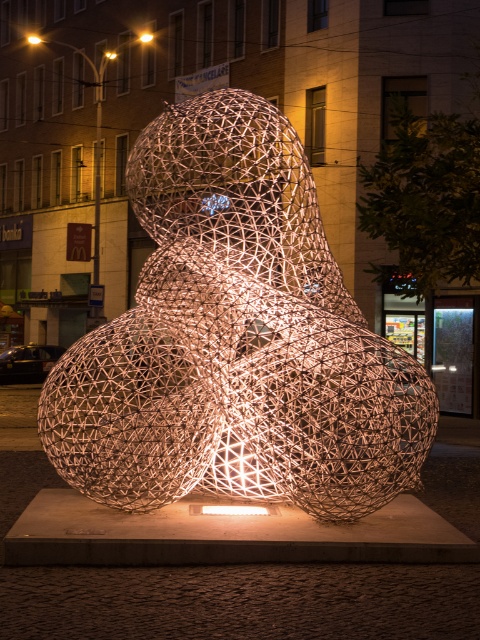
Is iridescent wire mesh sculpture at center to the right of yellow glass streetlight at upper center from the viewer's perspective?

Yes, iridescent wire mesh sculpture at center is to the right of yellow glass streetlight at upper center.

Describe the element at coordinates (236, 339) in the screenshot. Image resolution: width=480 pixels, height=640 pixels. I see `iridescent wire mesh sculpture at center` at that location.

Describe the element at coordinates (236, 339) in the screenshot. The image size is (480, 640). I see `iridescent wire mesh sculpture at center` at that location.

Where is `iridescent wire mesh sculpture at center`? iridescent wire mesh sculpture at center is located at coordinates (236, 339).

Does bright yellow light at center have a lesser width compared to yellow glass streetlight at upper center?

No, bright yellow light at center is not thinner than yellow glass streetlight at upper center.

Who is lower down, bright yellow light at center or yellow glass streetlight at upper center?

yellow glass streetlight at upper center

Describe the element at coordinates (145, 36) in the screenshot. I see `bright yellow light at center` at that location.

At what (x,y) coordinates should I click in order to perform the action: click on bright yellow light at center. Please return your answer as a coordinate pair (x, y). This screenshot has width=480, height=640. Looking at the image, I should click on (145, 36).

Is bright yellow light at center closer to camera compared to matte gold light at center?

Yes, bright yellow light at center is closer to the viewer.

Identify the location of bright yellow light at center. (145, 36).